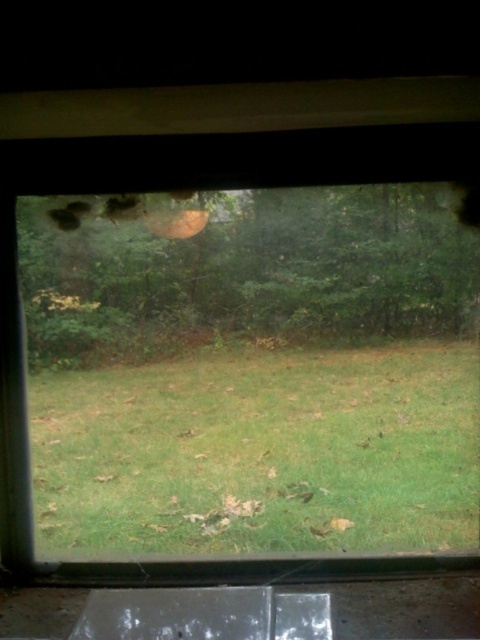
Question: Which point is closer to the camera?

Choices:
 (A) green grassy at center
 (B) green matte tree at center

Answer: (B)

Question: Is the position of green grassy at center less distant than that of green matte tree at center?

Choices:
 (A) no
 (B) yes

Answer: (A)

Question: Which point is closer to the camera?

Choices:
 (A) (392, 296)
 (B) (297, 465)

Answer: (B)

Question: Does green grassy at center lie behind green matte tree at center?

Choices:
 (A) no
 (B) yes

Answer: (B)

Question: Does green grassy at center have a greater width compared to green matte tree at center?

Choices:
 (A) no
 (B) yes

Answer: (A)